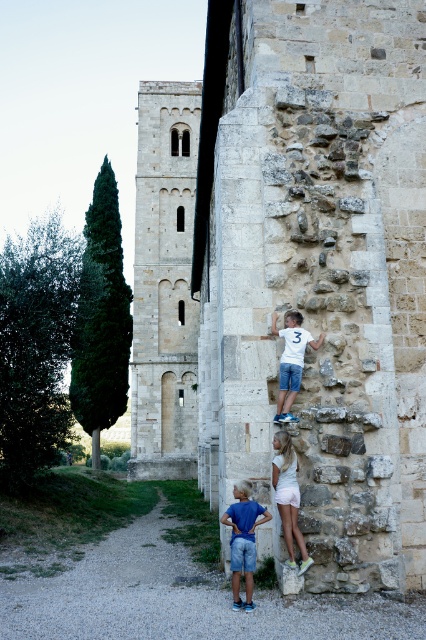
You are a painter standing at the center of the path. You want to paint both the stone textured wall at right and the white cotton shorts at center. Which object is taller?

The stone textured wall at right is taller than the white cotton shorts at center.

From the picture: You are standing on the paved path leading to the ancient stone building. You notice two points marked on the ground at coordinates point [158,461] and point [293,326]. Which point is closer to you as you face the building?

Point [158,461] is closer to you because it is further to the viewer than point [293,326].

You are a photographer trying to capture a photo of the stone textured tower at center and the white cotton shorts at center. Since you want both subjects to be in focus, you need to adjust your camera settings. Based on their positions, which subject should you focus on to ensure both are sharp?

The stone textured tower at center is located above the white cotton shorts at center. To ensure both are in focus, you should focus on the stone textured tower at center since it is farther away, as depth of field extends more behind the point of focus than in front.